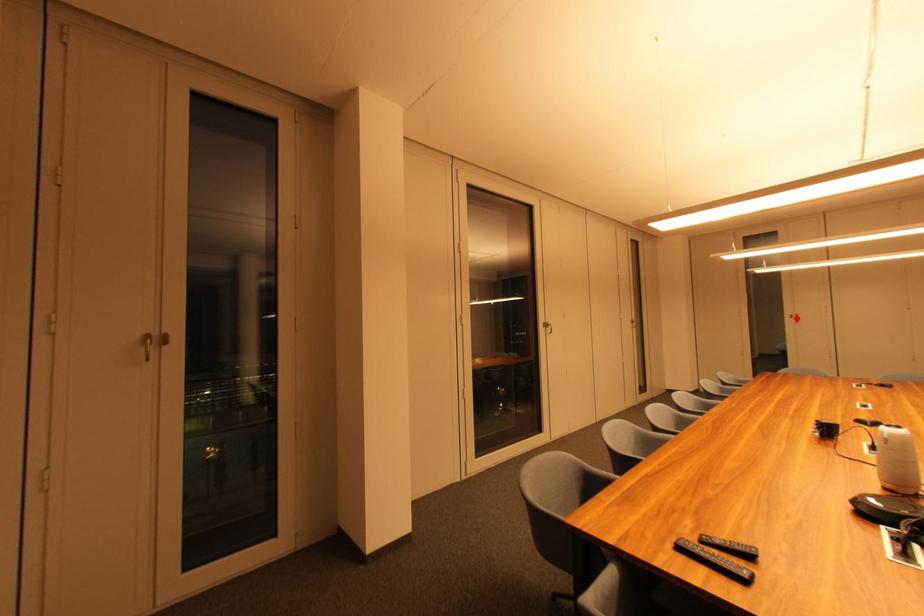
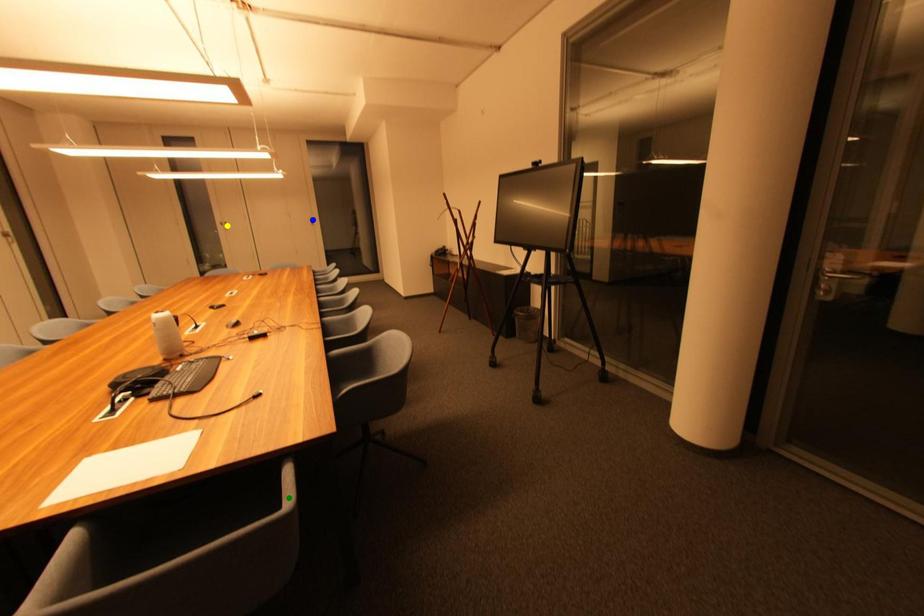
Question: I am providing you with two images of the same scene from different viewpoints. A red point is marked on the first image. You are given multiple points on the second image. Which point in image 2 represents the same 3d spot as the red point in image 1?

Choices:
 (A) yellow point
 (B) green point
 (C) blue point

Answer: (A)